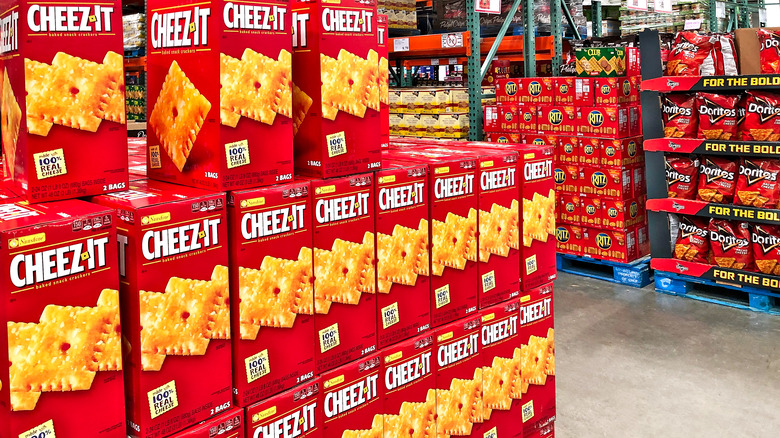
I want to click on columns, so click(x=743, y=17), click(x=714, y=18), click(x=597, y=13), click(x=557, y=29), click(x=530, y=31), click(x=479, y=52).